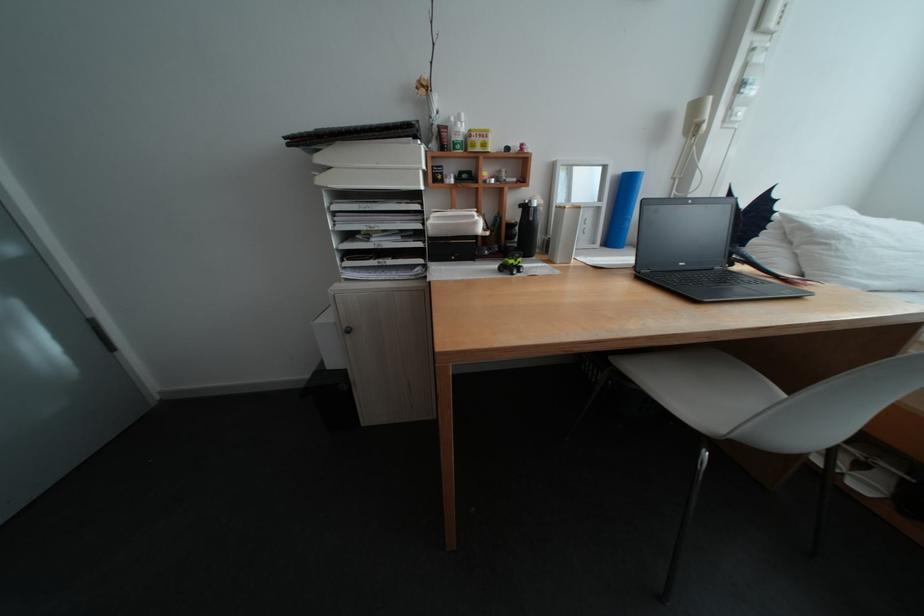
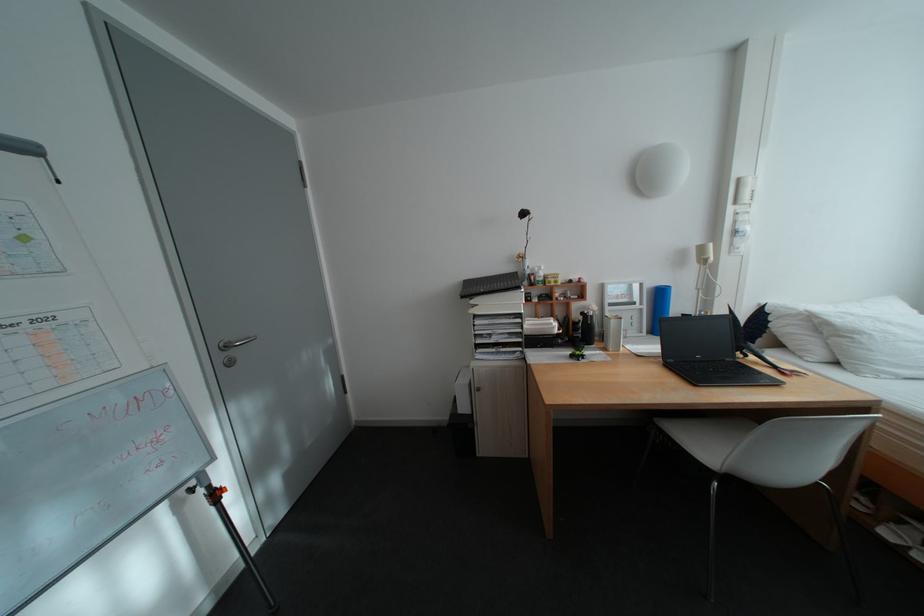
Question: The images are taken continuously from a first-person perspective. In which direction is your viewpoint rotating?

Choices:
 (A) Left
 (B) Right
 (C) Up
 (D) Down

Answer: (A)